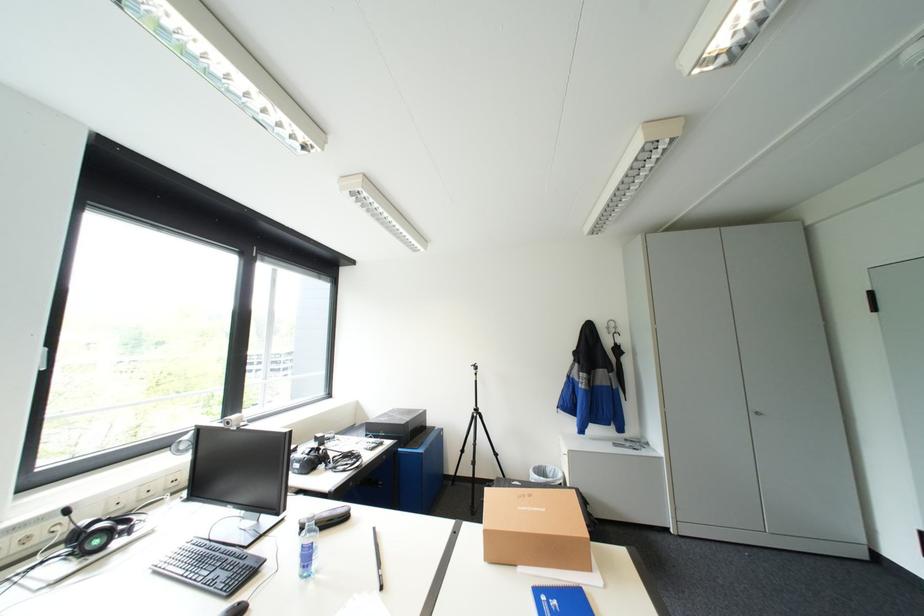
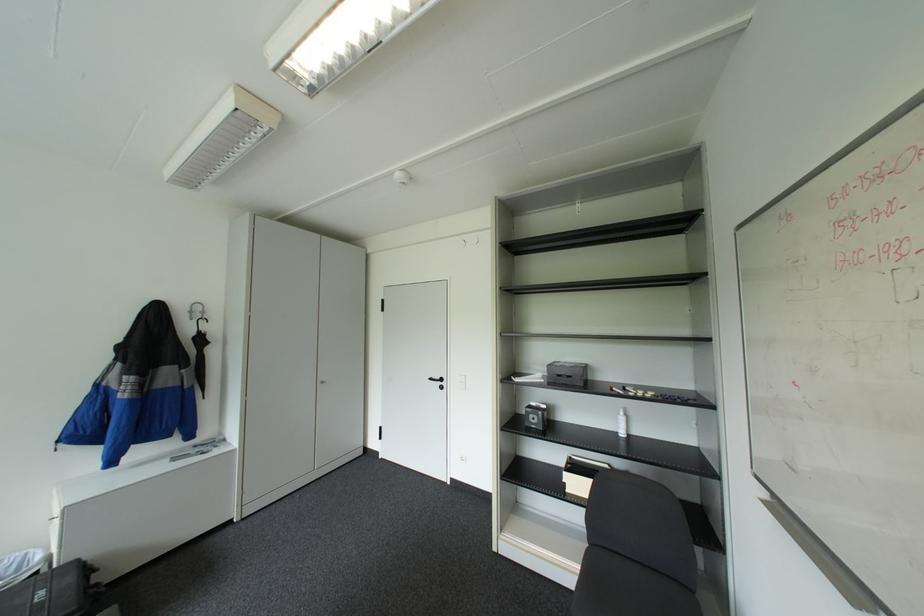
The point at (617, 331) is marked in the first image. Where is the corresponding point in the second image?

(200, 318)